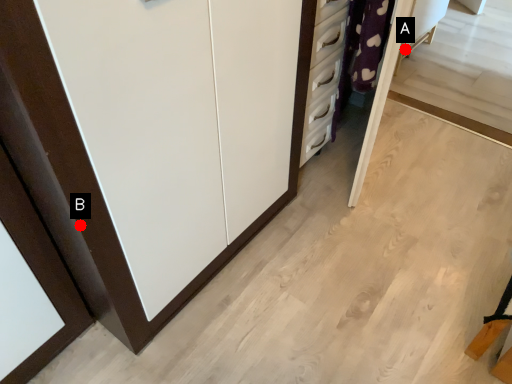
Question: Two points are circled on the image, labeled by A and B beside each circle. Which point is further to the camera?

Choices:
 (A) A is further
 (B) B is further

Answer: (A)